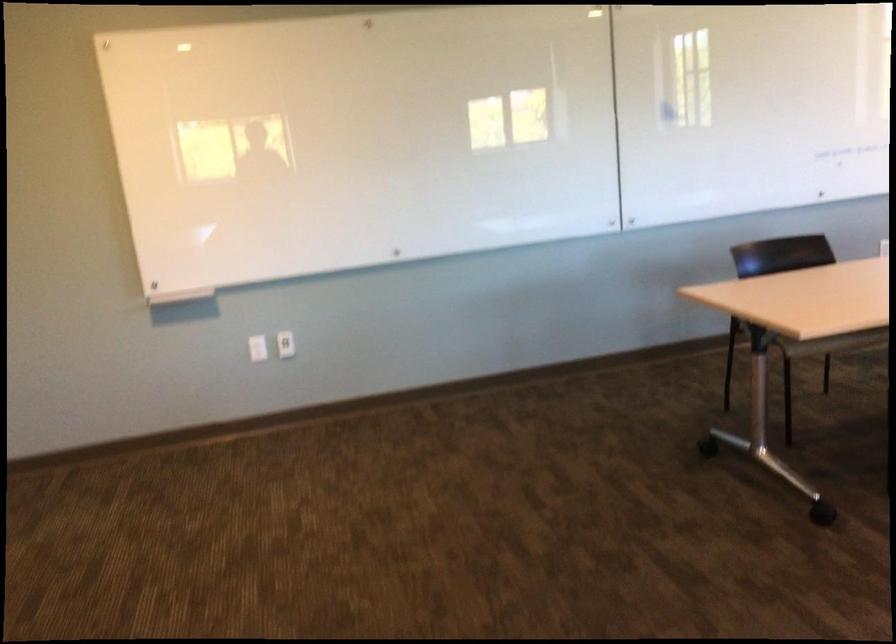
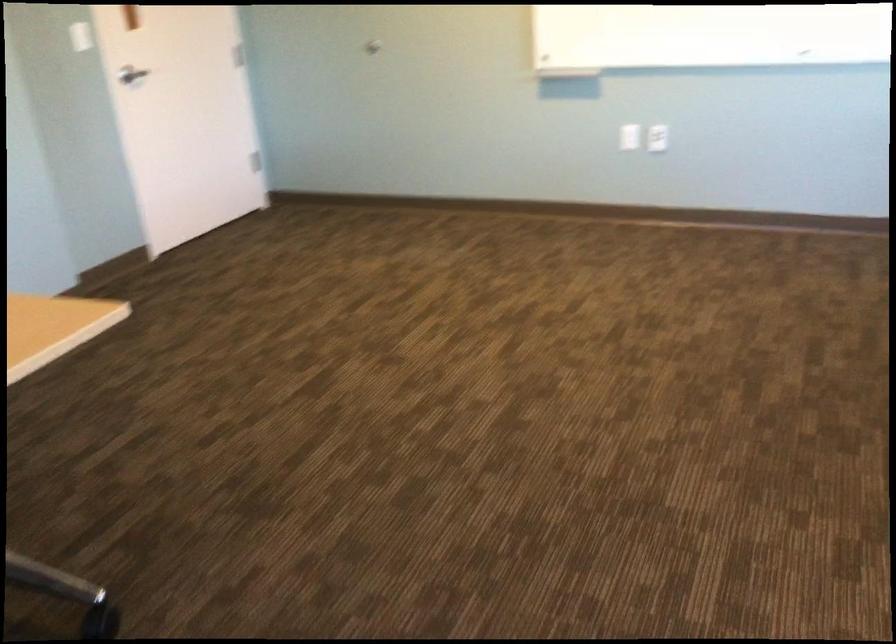
In the second image, find the point that corresponds to (288,348) in the first image.

(657, 138)